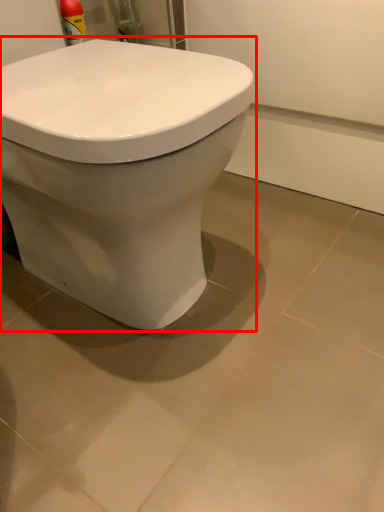
Question: From the image's perspective, where is toilet (annotated by the red box) located in relation to ceramic tile in the image?

Choices:
 (A) above
 (B) below

Answer: (A)